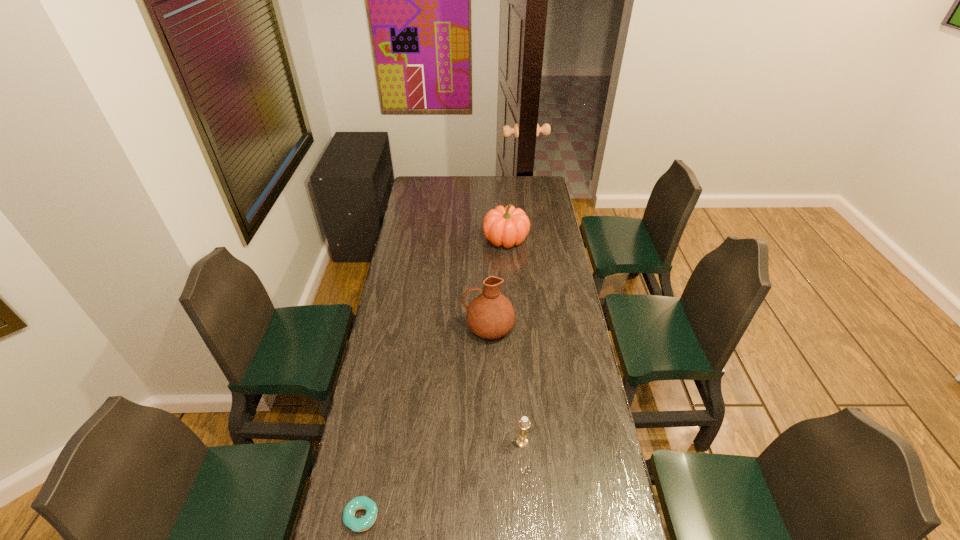
Find the location of a particular element. The height and width of the screenshot is (540, 960). vacant space that satisfies the following two spatial constraints: 1. on the side of the second farthest object with the handle; 2. on the back side of the second shortest object is located at coordinates (492, 442).

Find the location of a particular element. free space that satisfies the following two spatial constraints: 1. on the front side of the second tallest object; 2. on the side of the tallest object with the handle is located at coordinates (512, 327).

Locate an element on the screen. vacant space that satisfies the following two spatial constraints: 1. on the back side of the second nearest object; 2. on the side of the pitcher with the handle is located at coordinates (514, 327).

The height and width of the screenshot is (540, 960). What are the coordinates of `free region that satisfies the following two spatial constraints: 1. on the back side of the farthest object; 2. on the right side of the leftmost object` in the screenshot? It's located at (413, 239).